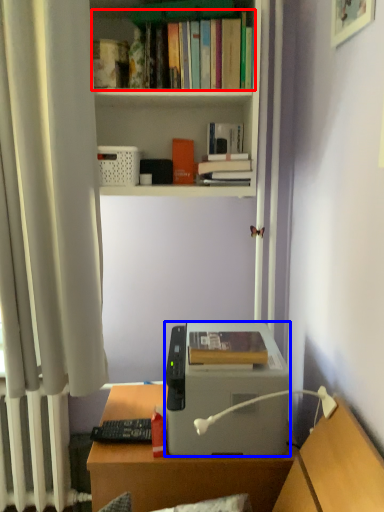
Question: Which of the following is the farthest to the observer, book (highlighted by a red box) or printer (highlighted by a blue box)?

Choices:
 (A) book
 (B) printer

Answer: (A)